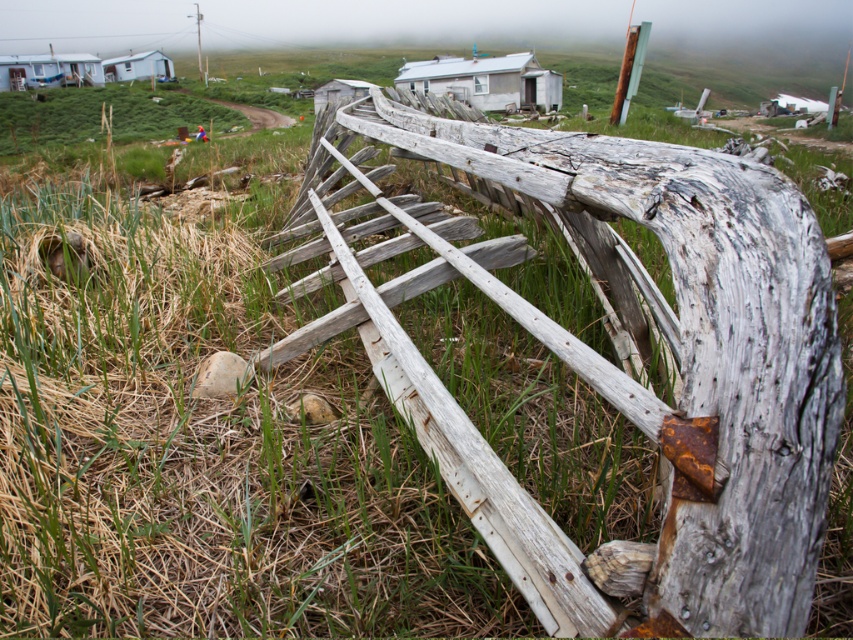
From the picture: Does white plastic hut at upper left have a greater height compared to white wooden hut at upper left?

Indeed, white plastic hut at upper left has a greater height compared to white wooden hut at upper left.

Between point (39, 67) and point (167, 67), which one is positioned behind?

The point (167, 67) is behind.

The width and height of the screenshot is (853, 640). What are the coordinates of `white plastic hut at upper left` in the screenshot? It's located at (48, 70).

Between weathered wood fence at center and white wooden hut at center, which one appears on the right side from the viewer's perspective?

Positioned to the right is white wooden hut at center.

Which of these two, weathered wood fence at center or white wooden hut at center, stands shorter?

With less height is weathered wood fence at center.

Between point (825, 465) and point (535, 90), which one is positioned in front?

Point (825, 465)

The width and height of the screenshot is (853, 640). I want to click on weathered wood fence at center, so click(688, 348).

Is weathered wood fence at center below white plastic hut at upper left?

Yes.

Is point (505, 163) closer to viewer compared to point (45, 60)?

Yes, point (505, 163) is in front of point (45, 60).

Does point (796, 228) lie in front of point (49, 44)?

Yes, it is in front of point (49, 44).

This screenshot has height=640, width=853. I want to click on weathered wood fence at center, so click(688, 348).